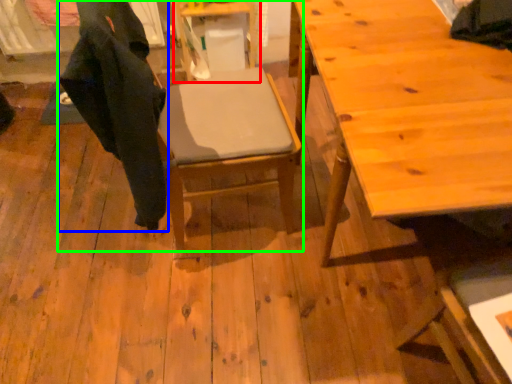
Question: Estimate the real-world distances between objects in this image. Which object is farther from table (highlighted by a red box), robe (highlighted by a blue box) or chair (highlighted by a green box)?

Choices:
 (A) robe
 (B) chair

Answer: (A)